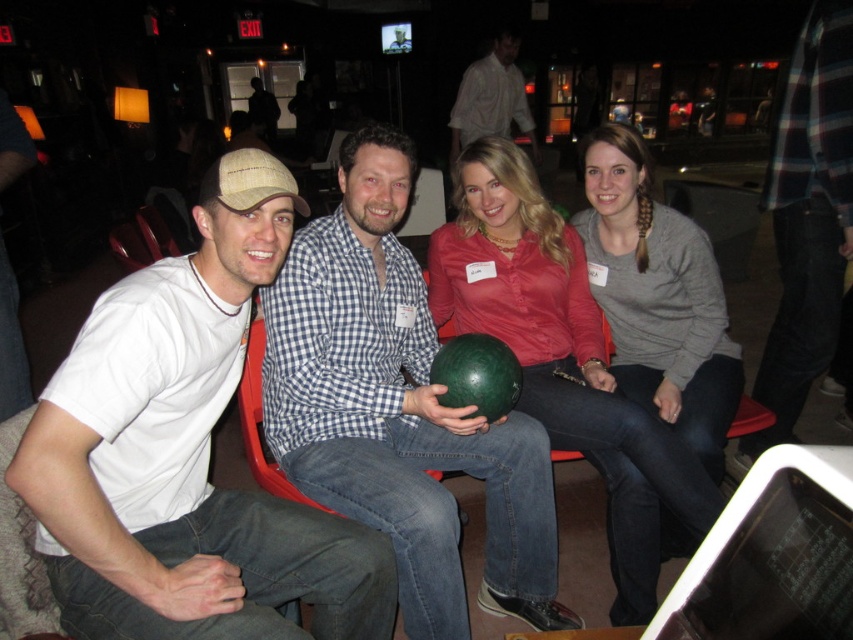
You are trying to decide which of the two men in the group is closer to the camera based on their clothing. The men are wearing a plaid flannel shirt at right and a white shirt at center. According to the scene, which one is taller?

The plaid flannel shirt at right is taller than the white shirt at center, so the man wearing the plaid flannel shirt at right is closer to the camera.

You are a photographer standing in front of the group at the bowling alley. You need to take a photo of the matte green bowling ball at center and the white shirt at center. Which object should you focus on first if you want to capture both in the same frame without moving the camera?

The matte green bowling ball at center is much taller than the white shirt at center, so you should focus on the matte green bowling ball at center first to ensure it fits within the frame before adjusting for the white shirt at center.